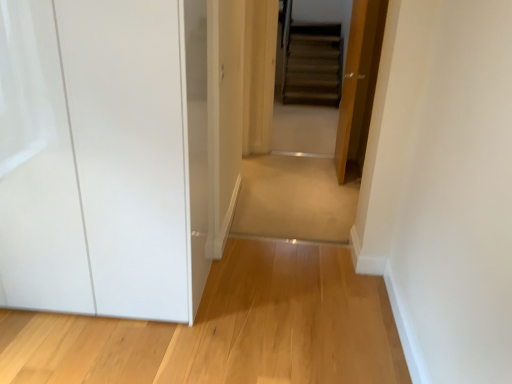
Question: Is light wood floor at lower left, which is counted as the 1th path, starting from the front, closer to the viewer compared to transparent glossy cabinet at left?

Choices:
 (A) yes
 (B) no

Answer: (B)

Question: Is light wood floor at lower left, the second path viewed from the top, positioned with its back to transparent glossy cabinet at left?

Choices:
 (A) no
 (B) yes

Answer: (A)

Question: From a real-world perspective, is light wood floor at lower left, which is the second path in back-to-front order, physically below transparent glossy cabinet at left?

Choices:
 (A) yes
 (B) no

Answer: (A)

Question: Is light wood floor at lower left, which is the second path in back-to-front order, shorter than transparent glossy cabinet at left?

Choices:
 (A) no
 (B) yes

Answer: (B)

Question: Is light wood floor at lower left, which is counted as the 1th path, starting from the front, far away from transparent glossy cabinet at left?

Choices:
 (A) no
 (B) yes

Answer: (A)

Question: Which is correct: light wood floor at lower left, acting as the first path starting from the bottom, is inside wooden door at center, or outside of it?

Choices:
 (A) inside
 (B) outside

Answer: (B)

Question: From the image's perspective, relative to wooden door at center, is light wood floor at lower left, acting as the first path starting from the bottom, above or below?

Choices:
 (A) above
 (B) below

Answer: (B)

Question: Looking at the image, does light wood floor at lower left, which is counted as the 1th path, starting from the front, seem bigger or smaller compared to wooden door at center?

Choices:
 (A) big
 (B) small

Answer: (B)

Question: Looking at their shapes, would you say light wood floor at lower left, acting as the first path starting from the bottom, is wider or thinner than wooden door at center?

Choices:
 (A) thin
 (B) wide

Answer: (B)

Question: Relative to light wood floor at lower left, the second path viewed from the top, is beige carpet at center, which ranks as the first path in back-to-front order, in front or behind?

Choices:
 (A) front
 (B) behind

Answer: (B)

Question: Considering the positions of point (309, 213) and point (220, 307), is point (309, 213) closer or farther from the camera than point (220, 307)?

Choices:
 (A) farther
 (B) closer

Answer: (A)

Question: Is beige carpet at center, which ranks as the first path in back-to-front order, wider or thinner than light wood floor at lower left, which is counted as the 1th path, starting from the front?

Choices:
 (A) thin
 (B) wide

Answer: (B)

Question: Based on their positions, is beige carpet at center, which ranks as the first path in back-to-front order, located to the left or right of light wood floor at lower left, which is counted as the 1th path, starting from the front?

Choices:
 (A) right
 (B) left

Answer: (A)

Question: In terms of height, does transparent glossy cabinet at left look taller or shorter compared to beige carpet at center, which is counted as the second path, starting from the bottom?

Choices:
 (A) tall
 (B) short

Answer: (A)

Question: In the image, is transparent glossy cabinet at left positioned in front of or behind beige carpet at center, which ranks as the first path in back-to-front order?

Choices:
 (A) behind
 (B) front

Answer: (B)